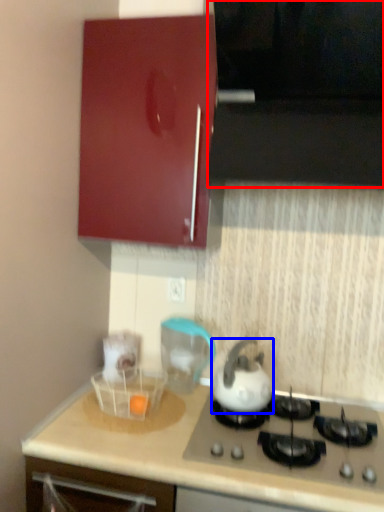
Question: Which object appears closest to the camera in this image, vent (highlighted by a red box) or kettle (highlighted by a blue box)?

Choices:
 (A) vent
 (B) kettle

Answer: (A)